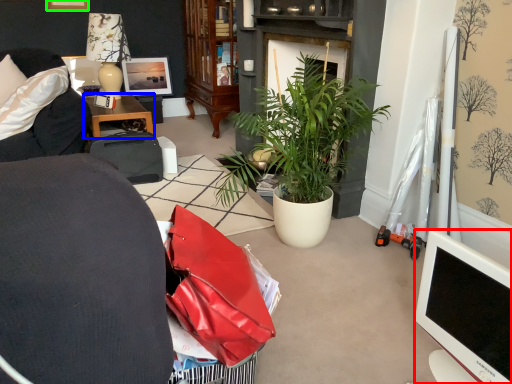
Question: Which object is positioned closest to television (highlighted by a red box)? Select from desk (highlighted by a blue box) and picture frame (highlighted by a green box).

Choices:
 (A) desk
 (B) picture frame

Answer: (A)